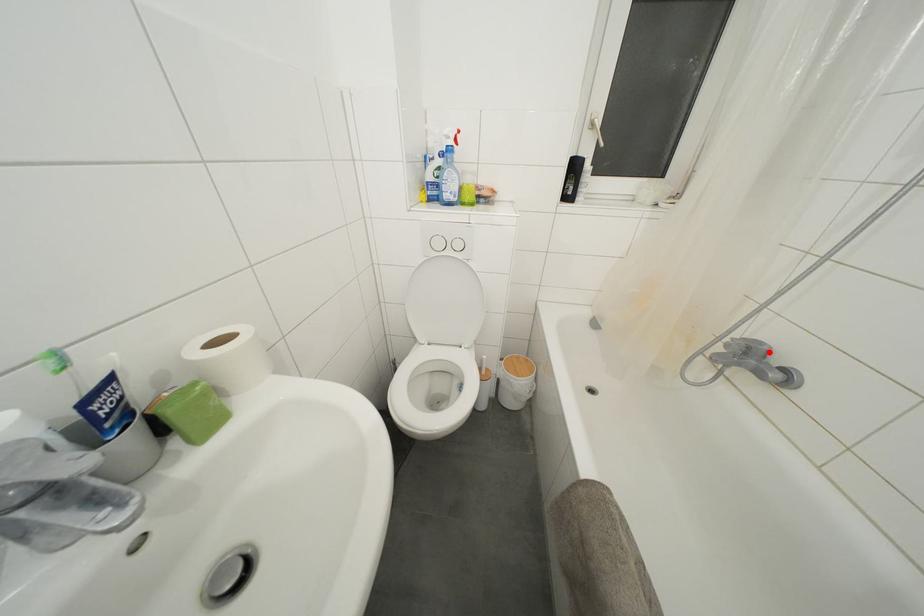
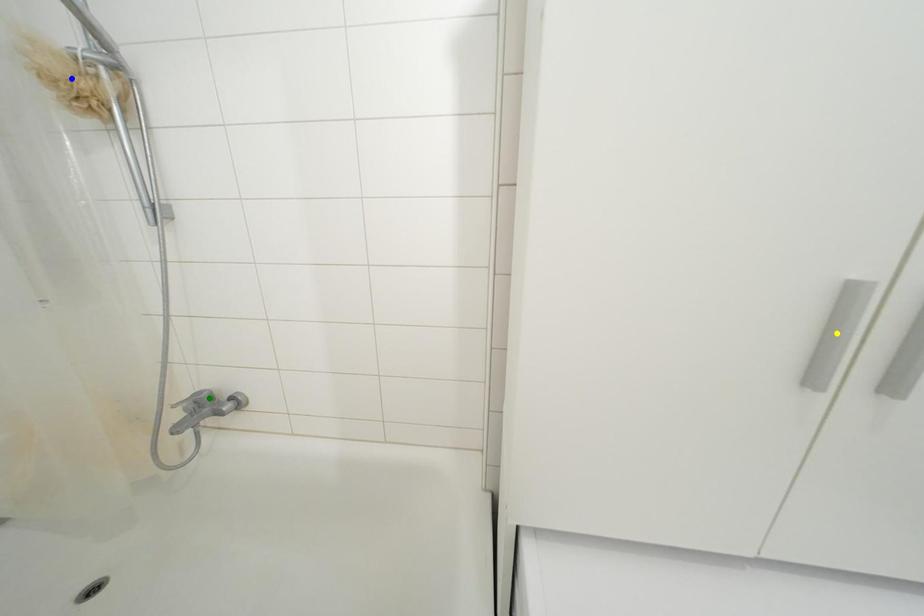
Question: I am providing you with two images of the same scene from different viewpoints. A red point is marked on the first image. You are given multiple points on the second image. Which point in image 2 is actually the same real-world point as the red point in image 1?

Choices:
 (A) green point
 (B) blue point
 (C) yellow point

Answer: (A)